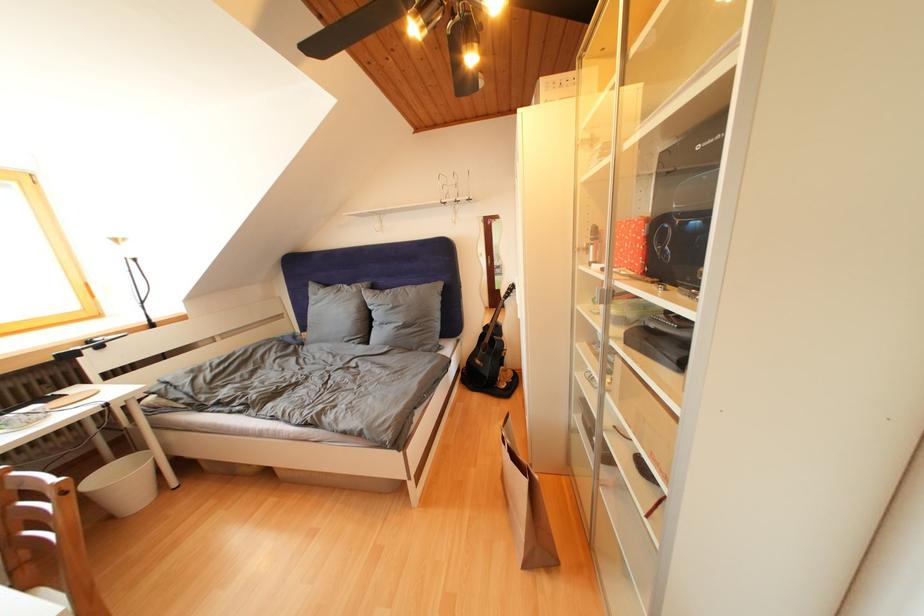
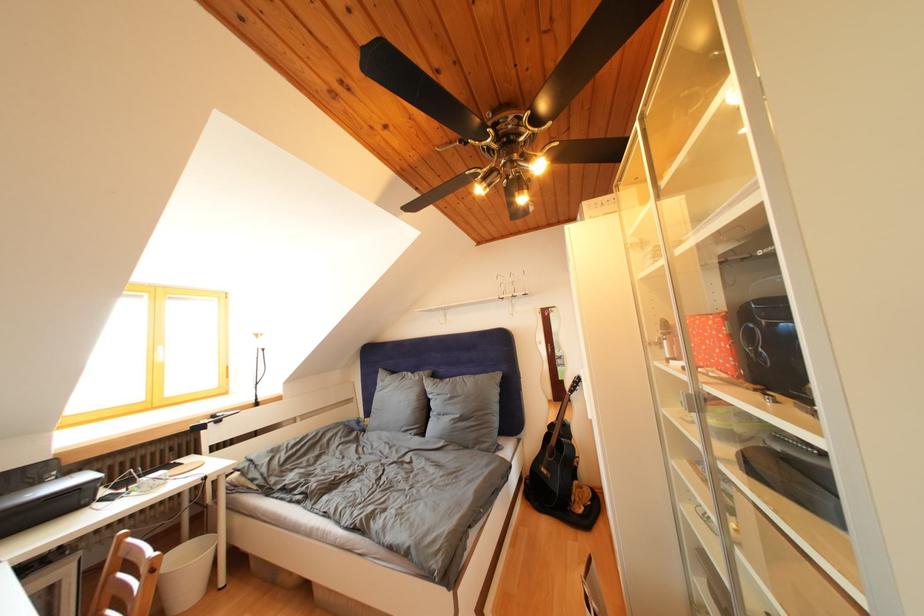
The point at (132, 480) is marked in the first image. Where is the corresponding point in the second image?

(198, 565)